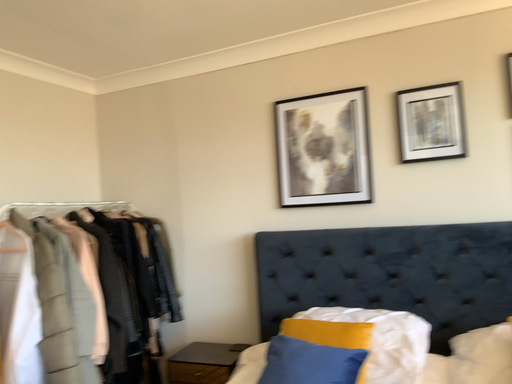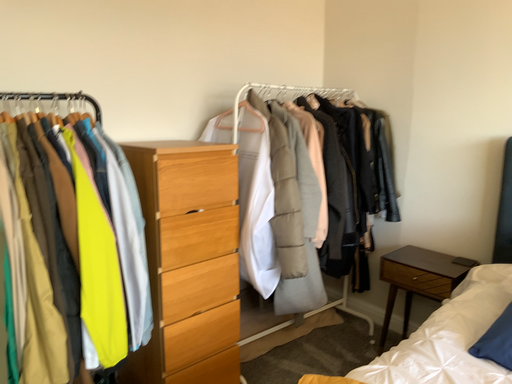
Question: How did the camera likely rotate when shooting the video?

Choices:
 (A) rotated upward
 (B) rotated downward

Answer: (B)